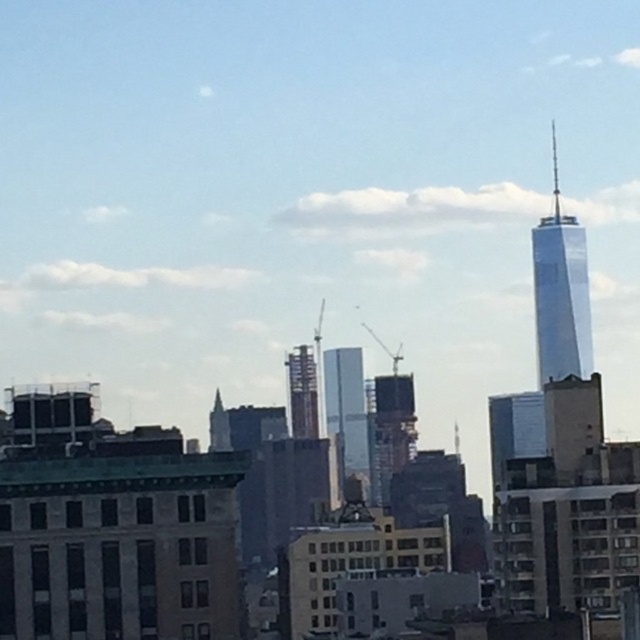
You are standing at the point with coordinates (x=561, y=292) in the cityscape. What object are you standing on?

The point at coordinates (x=561, y=292) corresponds to the white glass tower at upper right.

You are a drone operator tasked with flying a drone between the white glass tower at upper right and the metallic silver tower at center. The drone has a maximum flight range of 75 meters. Can the drone safely complete the flight between these two towers without exceeding its range?

The white glass tower at upper right and metallic silver tower at center are 76.05 meters apart. Since the drone has a maximum flight range of 75 meters, it cannot safely complete the flight between these two towers without exceeding its range.

You are an architect evaluating the city skyline. You notice the white glass tower at upper right and the metallic silver tower at center. Which tower has a greater height?

The white glass tower at upper right is bigger than the metallic silver tower at center, so it has a greater height.